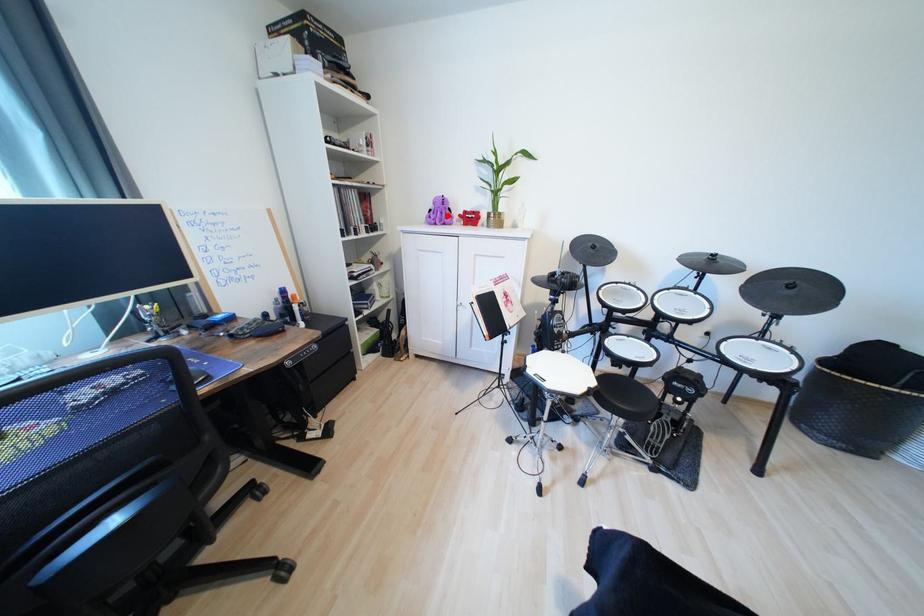
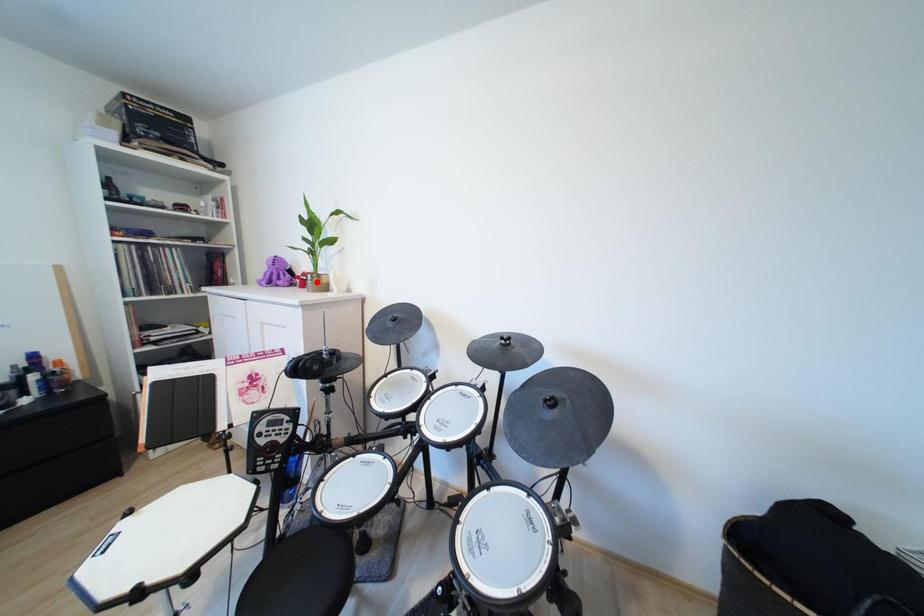
I am providing you with two images of the same scene from different viewpoints. A red point is marked on the first image and another point is marked on the second image. Is the marked point in image1 the same physical position as the marked point in image2?

No